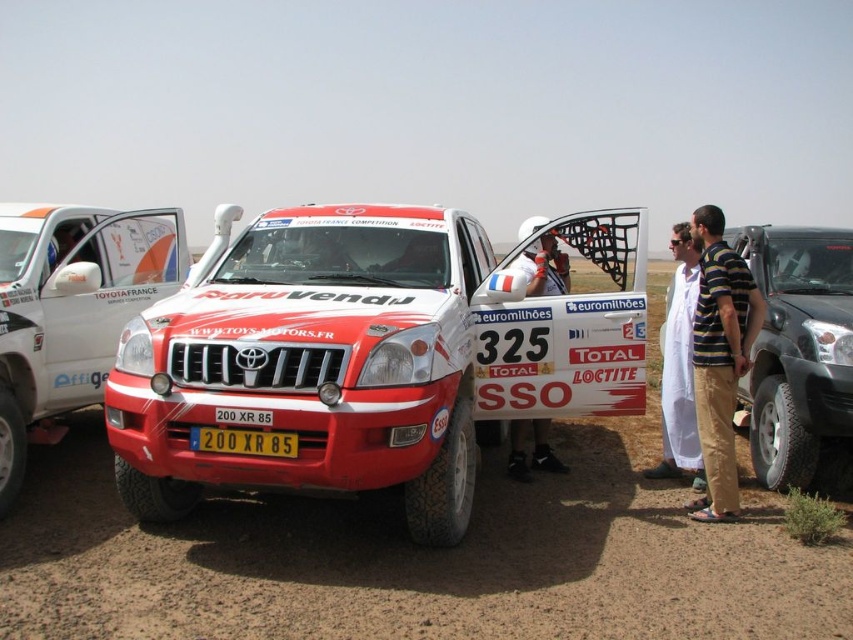
Question: Which point is farther to the camera?

Choices:
 (A) (726, 278)
 (B) (674, 396)
 (C) (160, 288)
 (D) (624, 305)

Answer: (C)

Question: Is white cloth at right thinner than yellow metallic license plate at center?

Choices:
 (A) yes
 (B) no

Answer: (A)

Question: Which point is farther from the camera taking this photo?

Choices:
 (A) (318, 208)
 (B) (685, 280)
 (C) (712, 458)
 (D) (560, 262)

Answer: (D)

Question: Among these objects, which one is farthest from the camera?

Choices:
 (A) striped cotton shirt at right
 (B) white fabric at center

Answer: (B)

Question: Considering the relative positions of matte red suv at center and yellow metallic license plate at center in the image provided, where is matte red suv at center located with respect to yellow metallic license plate at center?

Choices:
 (A) above
 (B) below

Answer: (A)

Question: Is matte white suv at center closer to camera compared to striped cotton shirt at right?

Choices:
 (A) yes
 (B) no

Answer: (A)